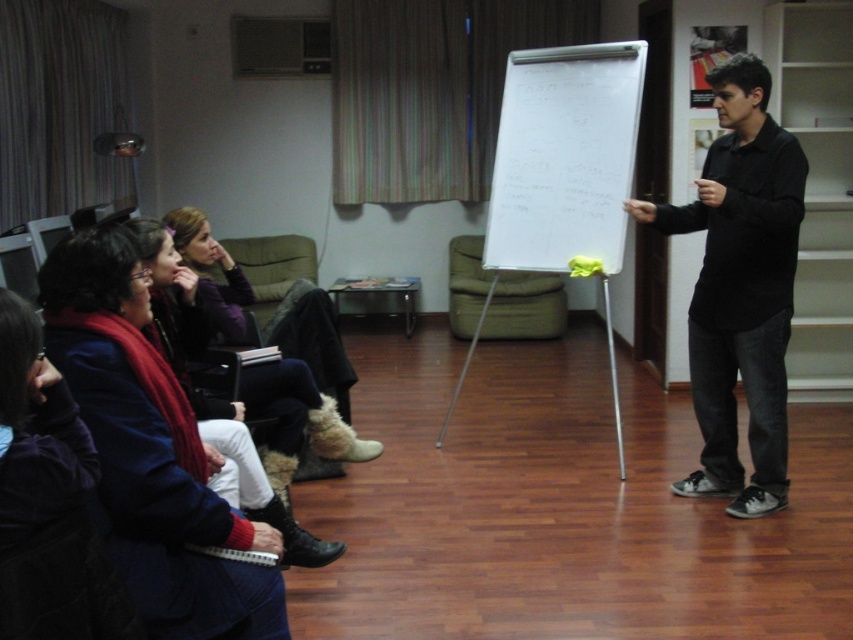
Describe the element at coordinates (740, 288) in the screenshot. I see `black matte shirt at center` at that location.

Which is above, black matte shirt at center or dark purple sweater at lower left?

black matte shirt at center is above.

The width and height of the screenshot is (853, 640). Describe the element at coordinates (740, 288) in the screenshot. I see `black matte shirt at center` at that location.

The height and width of the screenshot is (640, 853). Identify the location of black matte shirt at center. (740, 288).

Can you confirm if whiteboard at center is positioned above velvet purple sweater at center left?

Correct, whiteboard at center is located above velvet purple sweater at center left.

Can you confirm if whiteboard at center is taller than velvet purple sweater at center left?

Yes.

Who is more forward, (521, 122) or (364, 444)?

Point (364, 444) is in front.

Where is `whiteboard at center`? Image resolution: width=853 pixels, height=640 pixels. whiteboard at center is located at coordinates (564, 156).

Consider the image. Is black matte shirt at center thinner than velvet purple sweater at center left?

Incorrect, black matte shirt at center's width is not less than velvet purple sweater at center left's.

Does black matte shirt at center have a smaller size compared to velvet purple sweater at center left?

No, black matte shirt at center is not smaller than velvet purple sweater at center left.

Describe the element at coordinates (740, 288) in the screenshot. This screenshot has height=640, width=853. I see `black matte shirt at center` at that location.

Find the location of a particular element. black matte shirt at center is located at coordinates click(740, 288).